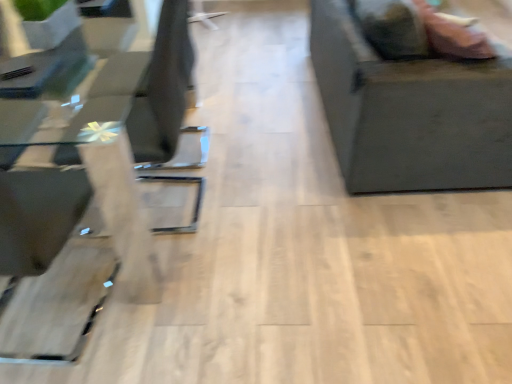
Question: Considering the relative positions of transparent glass table at left and matte black couch at right in the image provided, is transparent glass table at left to the left of matte black couch at right from the viewer's perspective?

Choices:
 (A) no
 (B) yes

Answer: (B)

Question: Is transparent glass table at left oriented away from matte black couch at right?

Choices:
 (A) no
 (B) yes

Answer: (A)

Question: Is transparent glass table at left closer to camera compared to matte black couch at right?

Choices:
 (A) yes
 (B) no

Answer: (A)

Question: From the image's perspective, is transparent glass table at left above matte black couch at right?

Choices:
 (A) yes
 (B) no

Answer: (B)

Question: From the image's perspective, does transparent glass table at left appear lower than matte black couch at right?

Choices:
 (A) yes
 (B) no

Answer: (A)

Question: From a real-world perspective, is transparent glass table at left positioned over matte black couch at right based on gravity?

Choices:
 (A) yes
 (B) no

Answer: (B)

Question: Is matte black couch at right wider than transparent glass table at left?

Choices:
 (A) yes
 (B) no

Answer: (A)

Question: Is the surface of matte black couch at right in direct contact with transparent glass table at left?

Choices:
 (A) yes
 (B) no

Answer: (B)

Question: Does matte black couch at right appear on the right side of transparent glass table at left?

Choices:
 (A) yes
 (B) no

Answer: (A)

Question: Would you consider matte black couch at right to be distant from transparent glass table at left?

Choices:
 (A) no
 (B) yes

Answer: (B)

Question: Considering the relative sizes of matte black couch at right and transparent glass table at left in the image provided, is matte black couch at right thinner than transparent glass table at left?

Choices:
 (A) yes
 (B) no

Answer: (B)

Question: Does matte black couch at right lie in front of transparent glass table at left?

Choices:
 (A) no
 (B) yes

Answer: (A)

Question: Considering the positions of point (102, 268) and point (351, 173), is point (102, 268) closer or farther from the camera than point (351, 173)?

Choices:
 (A) farther
 (B) closer

Answer: (B)